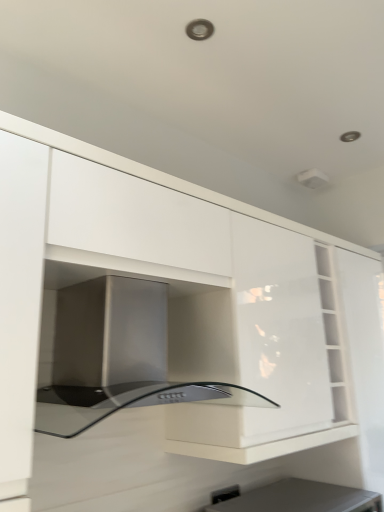
Locate an element on the screen. matte black appliance at lower center is located at coordinates (299, 498).

Where is `stainless steel oven at center`? This screenshot has height=512, width=384. stainless steel oven at center is located at coordinates (113, 357).

Looking at this image, which object is further away from the camera, stainless steel oven at center or black plastic electric outlet at lower center?

black plastic electric outlet at lower center is more distant.

Which is more to the right, stainless steel oven at center or black plastic electric outlet at lower center?

From the viewer's perspective, black plastic electric outlet at lower center appears more on the right side.

Could you tell me if stainless steel oven at center is facing black plastic electric outlet at lower center?

No, stainless steel oven at center is not aimed at black plastic electric outlet at lower center.

Between stainless steel oven at center and black plastic electric outlet at lower center, which one has larger size?

stainless steel oven at center.

Would you say stainless steel oven at center is a long distance from matte black appliance at lower center?

They are positioned close to each other.

Is stainless steel oven at center looking in the opposite direction of matte black appliance at lower center?

No, stainless steel oven at center's orientation is not away from matte black appliance at lower center.

Which of these two, stainless steel oven at center or matte black appliance at lower center, is smaller?

matte black appliance at lower center.

Is stainless steel oven at center in front of or behind matte black appliance at lower center in the image?

Clearly, stainless steel oven at center is in front of matte black appliance at lower center.

Based on the photo, between matte black appliance at lower center and stainless steel oven at center, which one appears on the left side from the viewer's perspective?

Positioned to the left is stainless steel oven at center.

From the image's perspective, who appears lower, matte black appliance at lower center or stainless steel oven at center?

matte black appliance at lower center, from the image's perspective.

The width and height of the screenshot is (384, 512). Identify the location of oven to the left of matte black appliance at lower center. (113, 357).

Is matte black appliance at lower center placed right next to stainless steel oven at center?

No, matte black appliance at lower center is not making contact with stainless steel oven at center.

How different are the orientations of black plastic electric outlet at lower center and stainless steel oven at center in degrees?

They differ by 0.265 degrees in their facing directions.

From a real-world perspective, is black plastic electric outlet at lower center on top of stainless steel oven at center?

No.

Is point (220, 490) farther from viewer compared to point (54, 381)?

Yes, point (220, 490) is farther from viewer.

From the image's perspective, which object appears higher, black plastic electric outlet at lower center or stainless steel oven at center?

stainless steel oven at center appears higher in the image.

Can you confirm if matte black appliance at lower center is positioned to the left of black plastic electric outlet at lower center?

No.

From the image's perspective, is matte black appliance at lower center positioned above or below black plastic electric outlet at lower center?

matte black appliance at lower center is below black plastic electric outlet at lower center.

From a real-world perspective, between matte black appliance at lower center and black plastic electric outlet at lower center, who is vertically higher?

black plastic electric outlet at lower center, from a real-world perspective.

Is matte black appliance at lower center touching black plastic electric outlet at lower center?

matte black appliance at lower center is not next to black plastic electric outlet at lower center, and they're not touching.

From a real-world perspective, is black plastic electric outlet at lower center on matte black appliance at lower center?

Yes, from a real-world perspective, black plastic electric outlet at lower center is on top of matte black appliance at lower center.

Is black plastic electric outlet at lower center turned away from matte black appliance at lower center?

No, matte black appliance at lower center is not at the back of black plastic electric outlet at lower center.

Between black plastic electric outlet at lower center and matte black appliance at lower center, which one has larger width?

matte black appliance at lower center is wider.

Which object is closer to the camera, black plastic electric outlet at lower center or matte black appliance at lower center?

matte black appliance at lower center is more forward.

Locate an element on the screen. The image size is (384, 512). electric outlet below the stainless steel oven at center (from a real-world perspective) is located at coordinates (225, 494).

This screenshot has width=384, height=512. I want to click on oven positioned vertically above the matte black appliance at lower center (from a real-world perspective), so click(113, 357).

Based on their spatial positions, is matte black appliance at lower center or stainless steel oven at center further from black plastic electric outlet at lower center?

stainless steel oven at center.

Considering their positions, is black plastic electric outlet at lower center positioned further to matte black appliance at lower center than stainless steel oven at center?

stainless steel oven at center.

Looking at the image, which one is located closer to matte black appliance at lower center, stainless steel oven at center or black plastic electric outlet at lower center?

Based on the image, black plastic electric outlet at lower center appears to be nearer to matte black appliance at lower center.

Considering their positions, is matte black appliance at lower center positioned closer to stainless steel oven at center than black plastic electric outlet at lower center?

matte black appliance at lower center is closer to stainless steel oven at center.

Considering their positions, is stainless steel oven at center positioned further to black plastic electric outlet at lower center than matte black appliance at lower center?

stainless steel oven at center is positioned further to the anchor black plastic electric outlet at lower center.

Considering their positions, is black plastic electric outlet at lower center positioned closer to stainless steel oven at center than matte black appliance at lower center?

matte black appliance at lower center is positioned closer to the anchor stainless steel oven at center.

Find the location of a particular element. This screenshot has height=512, width=384. appliance between stainless steel oven at center and black plastic electric outlet at lower center along the z-axis is located at coordinates (299, 498).